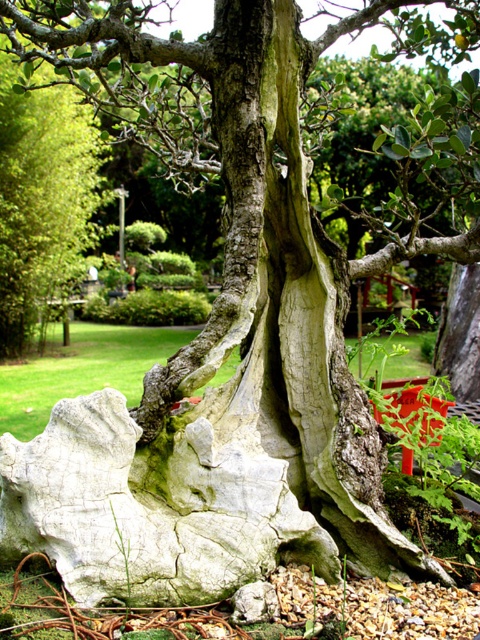
Question: Which point appears closest to the camera in this image?

Choices:
 (A) click(140, 572)
 (B) click(31, 132)

Answer: (A)

Question: Can you confirm if white cracked rock at center is positioned to the left of smooth gray bark at center?

Choices:
 (A) yes
 (B) no

Answer: (B)

Question: Can you confirm if white cracked rock at center is positioned below smooth gray bark at center?

Choices:
 (A) yes
 (B) no

Answer: (A)

Question: Which point is closer to the camera?

Choices:
 (A) white cracked rock at center
 (B) smooth gray bark at center

Answer: (A)

Question: Can you confirm if white cracked rock at center is positioned above smooth gray bark at center?

Choices:
 (A) no
 (B) yes

Answer: (A)